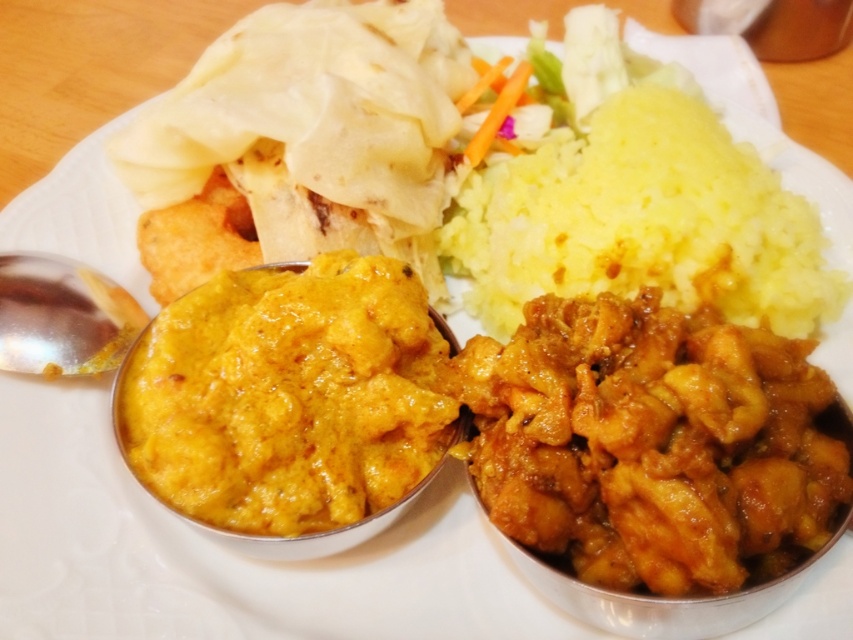
Question: Does yellow creamy curry at center appear on the right side of metallic spoon at lower left?

Choices:
 (A) no
 (B) yes

Answer: (B)

Question: Among these objects, which one is farthest from the camera?

Choices:
 (A) yellow creamy curry at center
 (B) metallic spoon at lower left

Answer: (B)

Question: Observing the image, what is the correct spatial positioning of brown glossy chicken curry at center in reference to yellow creamy curry at center?

Choices:
 (A) above
 (B) below

Answer: (B)

Question: Among these objects, which one is farthest from the camera?

Choices:
 (A) brown glossy chicken curry at center
 (B) metallic spoon at lower left
 (C) yellow/yellowish-white/mashed rice at upper right

Answer: (C)

Question: Considering the real-world distances, which object is farthest from the yellow creamy curry at center?

Choices:
 (A) metallic spoon at lower left
 (B) brown glossy chicken curry at center
 (C) yellow/yellowish-white/mashed rice at upper right

Answer: (C)

Question: Does brown glossy chicken curry at center appear on the right side of yellow creamy curry at center?

Choices:
 (A) yes
 (B) no

Answer: (A)